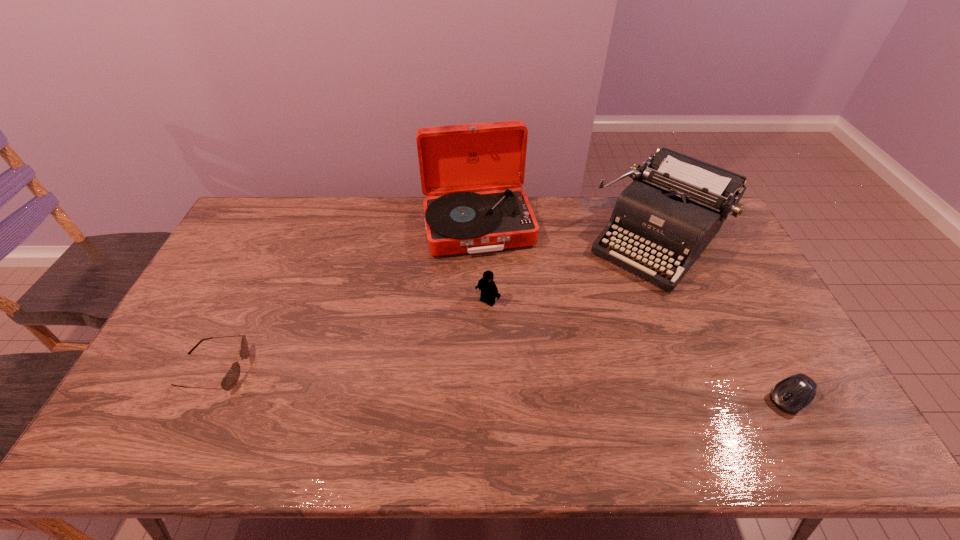
Where is `free space on the desktop that is between the leftmost object and the mouse and is positioned on the face of the third shortest object`? free space on the desktop that is between the leftmost object and the mouse and is positioned on the face of the third shortest object is located at coordinates (420, 379).

The width and height of the screenshot is (960, 540). Find the location of `vacant space on the desktop that is between the sunglasses and the mouse and is positioned on the front-facing side of the phonograph_record`. vacant space on the desktop that is between the sunglasses and the mouse and is positioned on the front-facing side of the phonograph_record is located at coordinates (516, 384).

Image resolution: width=960 pixels, height=540 pixels. I want to click on vacant space on the desktop that is between the sunglasses and the mouse and is positioned on the front-facing side of the typewriter, so click(x=528, y=384).